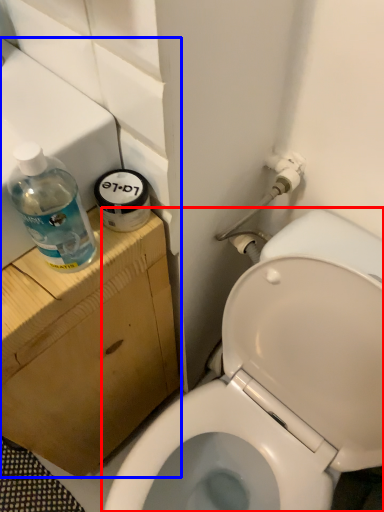
Question: Which object appears farthest to the camera in this image, toilet (highlighted by a red box) or sink (highlighted by a blue box)?

Choices:
 (A) toilet
 (B) sink

Answer: (B)